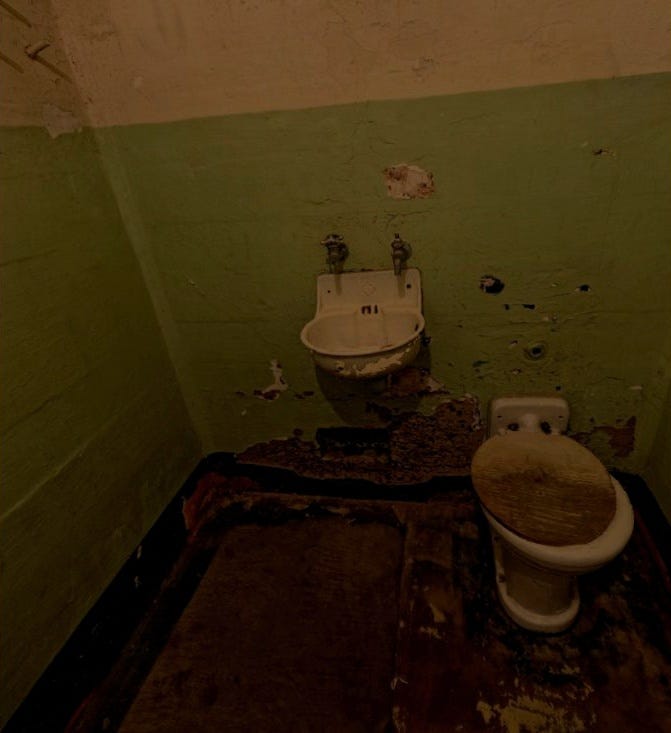
The width and height of the screenshot is (671, 733). What are the coordinates of `back wall` in the screenshot? It's located at [x=233, y=396].